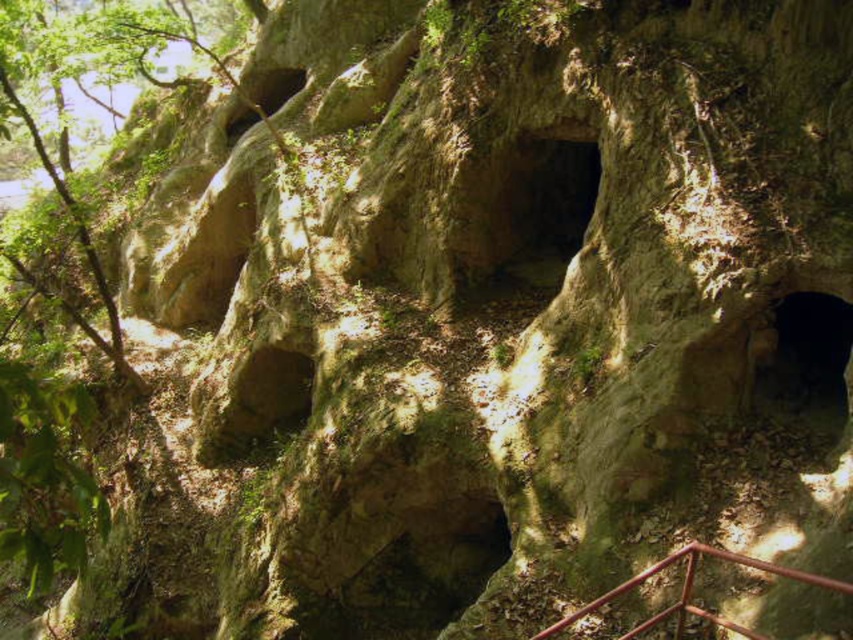
Can you confirm if dark brown stone cave at lower right is positioned to the left of red metal railing at lower right?

In fact, dark brown stone cave at lower right is to the right of red metal railing at lower right.

Describe the element at coordinates (804, 362) in the screenshot. I see `dark brown stone cave at lower right` at that location.

At what (x,y) coordinates should I click in order to perform the action: click on dark brown stone cave at lower right. Please return your answer as a coordinate pair (x, y). Looking at the image, I should click on (804, 362).